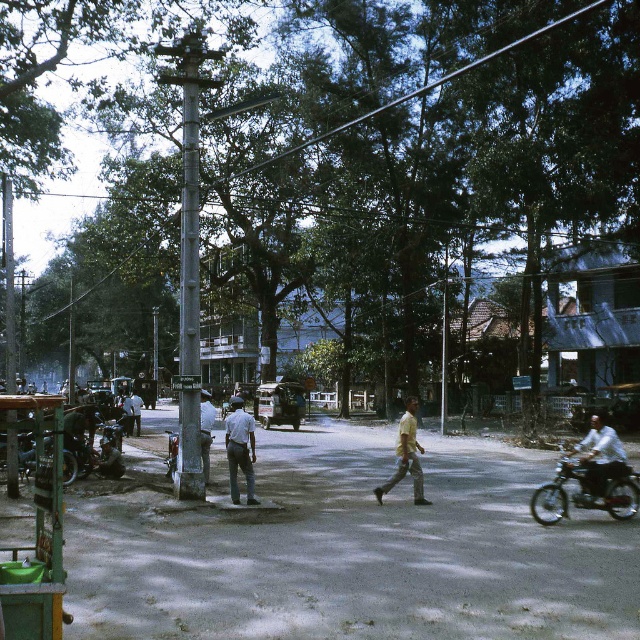
Question: From the image, what is the correct spatial relationship of light blue denim pants at center in relation to light blue shirt at center?

Choices:
 (A) right
 (B) left

Answer: (A)

Question: Considering the relative positions of smooth gray pole at center and shiny black motorcycle at right in the image provided, where is smooth gray pole at center located with respect to shiny black motorcycle at right?

Choices:
 (A) below
 (B) above

Answer: (B)

Question: Which of the following is the farthest from the observer?

Choices:
 (A) (576, 500)
 (B) (234, 486)
 (C) (413, 451)
 (D) (332, 134)

Answer: (C)

Question: Which point is closer to the camera?

Choices:
 (A) (253, 442)
 (B) (177, 444)

Answer: (B)

Question: Is smooth gray pole at center smaller than light blue denim pants at center?

Choices:
 (A) no
 (B) yes

Answer: (A)

Question: Which of the following is the farthest from the observer?

Choices:
 (A) (372, 112)
 (B) (596, 419)
 (C) (195, 378)
 (D) (556, 500)

Answer: (C)